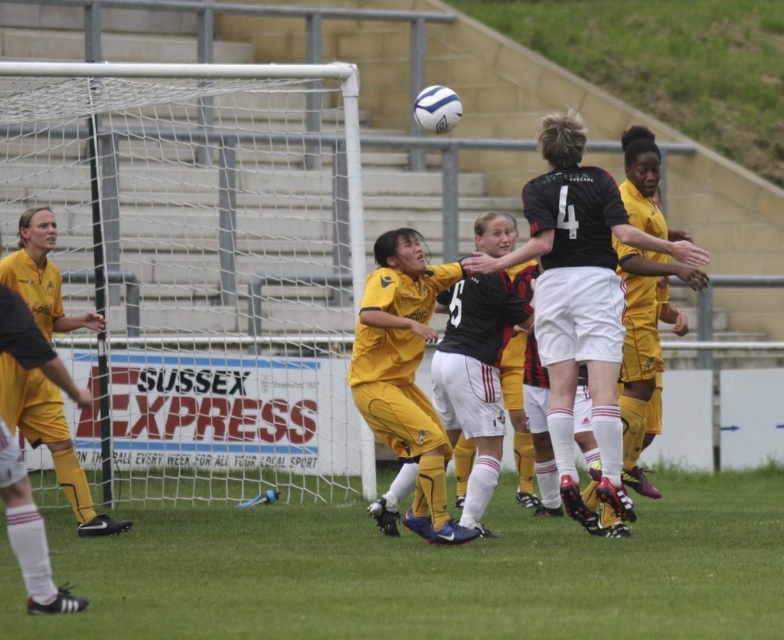
Question: Is white mesh net at center wider than green grass at lower center?

Choices:
 (A) no
 (B) yes

Answer: (A)

Question: Which point is closer to the camera?

Choices:
 (A) (31, 237)
 (B) (622, 202)
 (C) (477, 557)

Answer: (C)

Question: Can you confirm if white mesh net at center is thinner than green grass at lower center?

Choices:
 (A) no
 (B) yes

Answer: (B)

Question: Does green grass at lower center have a smaller size compared to yellow jersey at left?

Choices:
 (A) yes
 (B) no

Answer: (B)

Question: Which point is closer to the camera?

Choices:
 (A) (273, 340)
 (B) (724, 621)
 (C) (28, 260)

Answer: (B)

Question: Which of these objects is positioned farthest from the white mesh net at center?

Choices:
 (A) green grass at lower center
 (B) yellow jersey at left

Answer: (A)